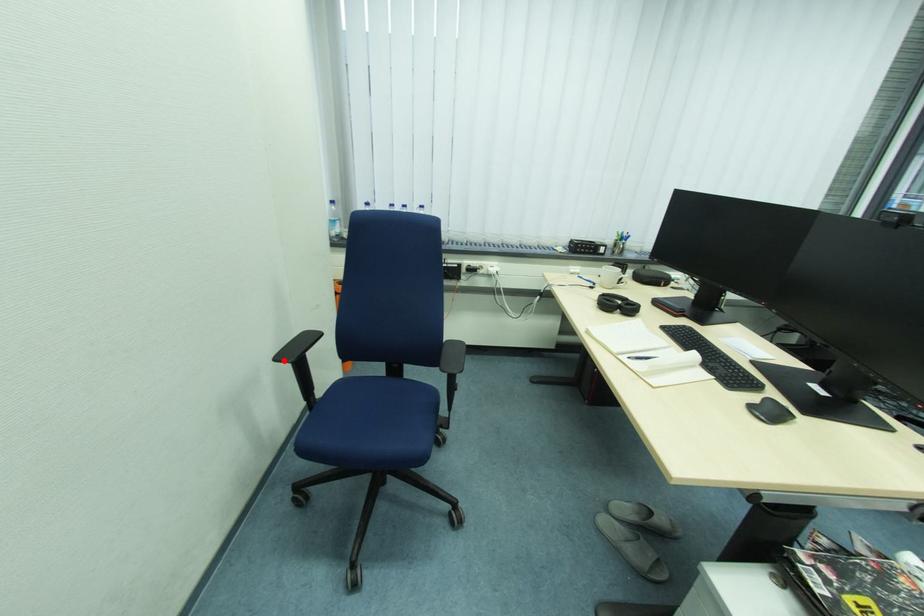
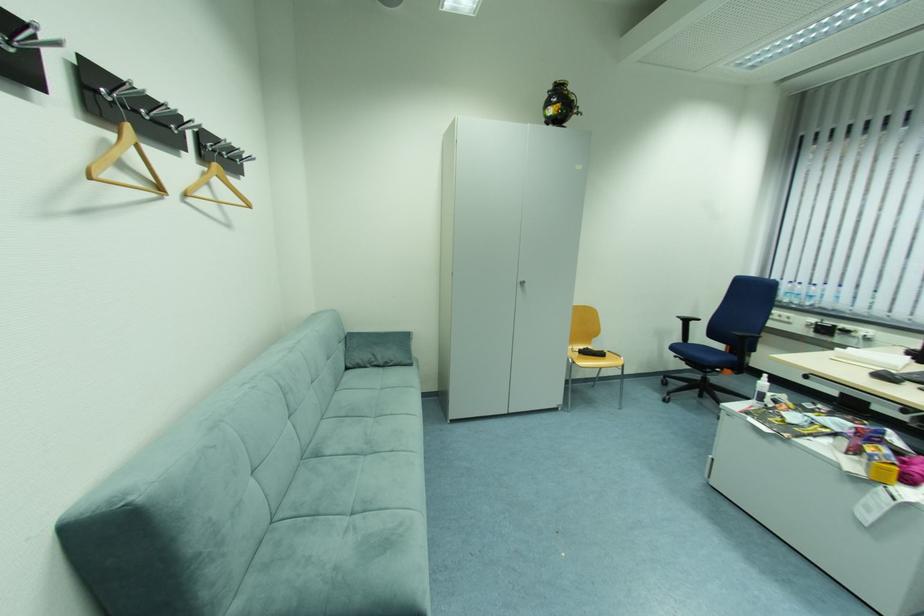
Find the pixel in the second image that matches the highlighted location in the first image.

(685, 318)